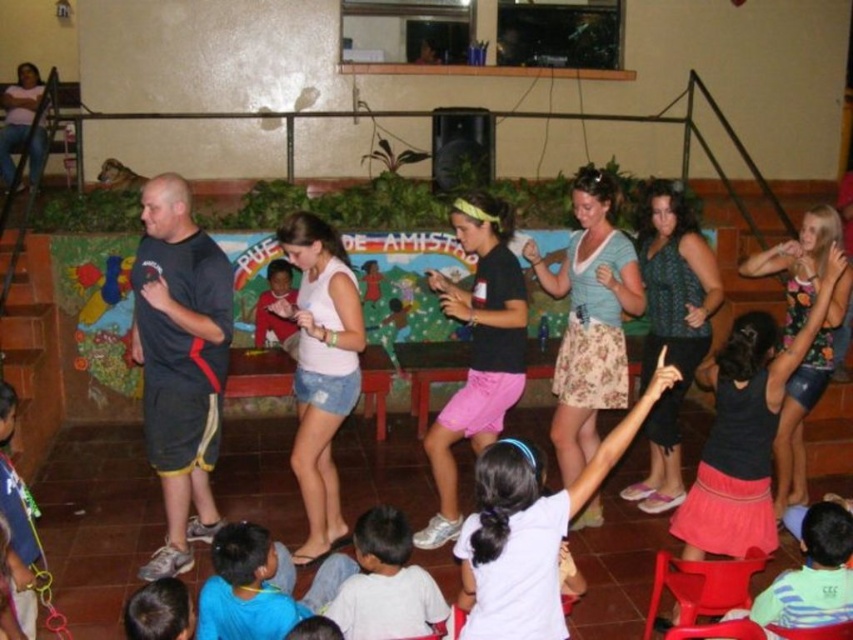
Who is shorter, black fabric shirt at center or white cotton shirt at lower center?

white cotton shirt at lower center

Does black fabric shirt at center come in front of white cotton shirt at lower center?

No.

Does point (164, 208) come in front of point (387, 636)?

That is False.

You are a GUI agent. You are given a task and a screenshot of the screen. Output one action in this format:
    pyautogui.click(x=<x>, y=<y>)
    Task: Click on the black fabric shirt at center
    This screenshot has height=640, width=853.
    Given the screenshot: What is the action you would take?
    pyautogui.click(x=180, y=362)

Is white cotton shirt at lower center above light blue t-shirt at center?

Incorrect, white cotton shirt at lower center is not positioned above light blue t-shirt at center.

Does point (383, 520) come closer to viewer compared to point (767, 618)?

No, (383, 520) is further to viewer.

Does point (407, 576) come closer to viewer compared to point (813, 605)?

No, it is behind (813, 605).

Find the location of `white cotton shirt at lower center`. white cotton shirt at lower center is located at coordinates (386, 584).

Who is lower down, black fabric shirt at center or light blue t-shirt at center?

→ light blue t-shirt at center is lower down.

Is black fabric shirt at center below light blue t-shirt at center?

Actually, black fabric shirt at center is above light blue t-shirt at center.

Image resolution: width=853 pixels, height=640 pixels. What do you see at coordinates (180, 362) in the screenshot? I see `black fabric shirt at center` at bounding box center [180, 362].

Locate an element on the screen. The height and width of the screenshot is (640, 853). black fabric shirt at center is located at coordinates (180, 362).